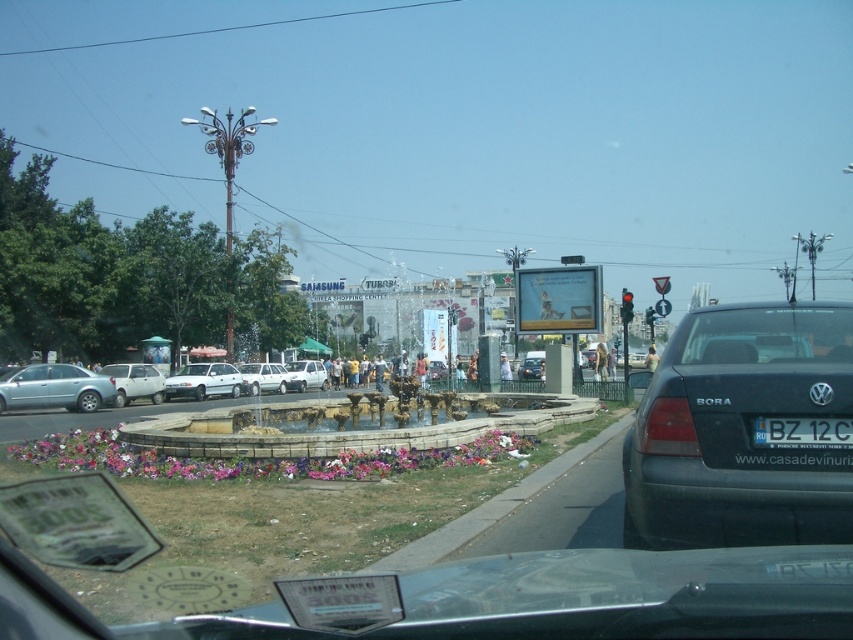
Between point (827, 512) and point (224, 372), which one is positioned in front?

Point (827, 512)

Who is shorter, black matte car at right or white matte sedan at center?

white matte sedan at center

Describe the element at coordinates (746, 429) in the screenshot. This screenshot has width=853, height=640. I see `black matte car at right` at that location.

This screenshot has width=853, height=640. Find the location of `black matte car at right`. black matte car at right is located at coordinates (746, 429).

Which is more to the right, white plastic license plate at center or red glass traffic light at center?

red glass traffic light at center is more to the right.

Who is more forward, (759, 445) or (625, 310)?

Point (759, 445)

Where is `white plastic license plate at center`? The image size is (853, 640). white plastic license plate at center is located at coordinates (802, 433).

Can you confirm if white matte sedan at center is bigger than white matte van at center?

Correct, white matte sedan at center is larger in size than white matte van at center.

Who is shorter, white matte sedan at center or white matte van at center?

white matte van at center is shorter.

Does point (206, 365) come behind point (322, 369)?

No, (206, 365) is closer to viewer.

The image size is (853, 640). I want to click on white matte sedan at center, so click(202, 381).